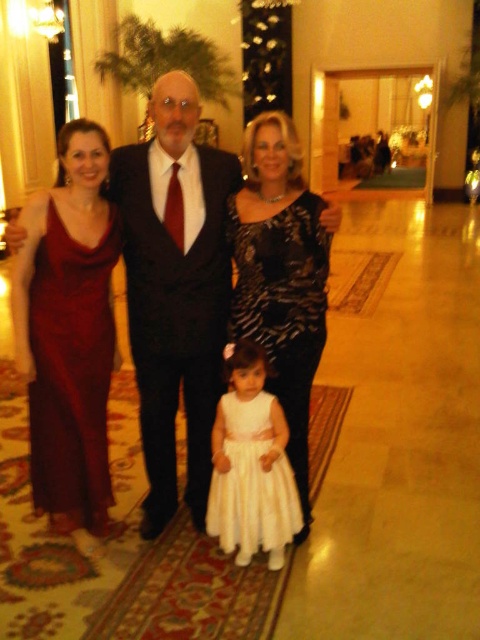
Consider the image. Does matte black suit at center have a greater height compared to white satin dress at center?

Indeed, matte black suit at center has a greater height compared to white satin dress at center.

Who is more distant from viewer, (153, 461) or (267, 451)?

The point (153, 461) is more distant.

Describe the element at coordinates (175, 292) in the screenshot. I see `matte black suit at center` at that location.

Locate an element on the screen. Image resolution: width=480 pixels, height=640 pixels. matte black suit at center is located at coordinates (175, 292).

Is point (208, 349) positioned in front of point (131, 316)?

Yes.

Consider the image. Does matte black suit at center lie in front of dark blue wool suit at center?

Yes, it is in front of dark blue wool suit at center.

Is point (196, 99) positioned before point (141, 314)?

That is True.

This screenshot has height=640, width=480. Find the location of `matte black suit at center`. matte black suit at center is located at coordinates 175,292.

Is point (218, 301) farther from viewer compared to point (28, 413)?

No, it is not.

From the picture: Which is above, dark blue wool suit at center or matte red dress at left?

dark blue wool suit at center is higher up.

Is point (188, 337) positioned in front of point (84, 444)?

No, it is behind (84, 444).

Image resolution: width=480 pixels, height=640 pixels. Identify the location of dark blue wool suit at center. (176, 320).